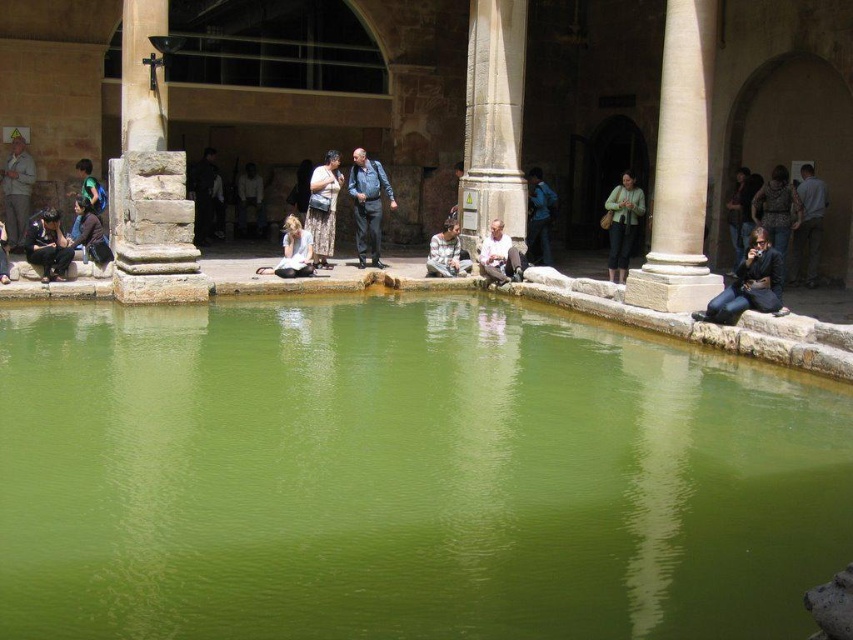
Looking at this image, you are standing in the courtyard and want to pick up the dark gray fabric jacket at lower right and the dark brown leather jacket at lower left. Which jacket will you need to move first to reach the one behind it?

The dark gray fabric jacket at lower right is in front of the dark brown leather jacket at lower left, so you need to move the dark gray fabric jacket at lower right first to access the one behind it.

You are standing in the courtyard and want to pass between the smooth stone column at center and the patterned fabric dress at center. Can you walk through the space between them?

The smooth stone column at center is wider than the patterned fabric dress at center, so the space between them may be narrow. However, without knowing the exact distance between the two objects, it is uncertain if there is enough space to walk through comfortably.